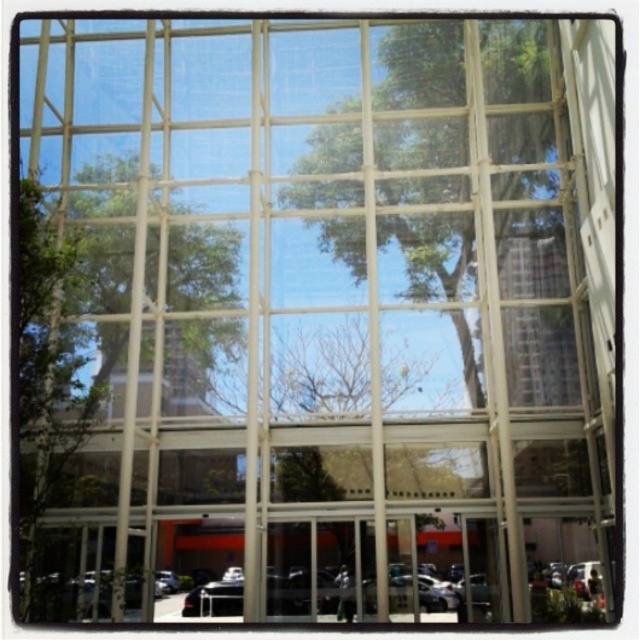
Can you confirm if green leafy tree at center is positioned to the right of green leafy tree at upper left?

Indeed, green leafy tree at center is positioned on the right side of green leafy tree at upper left.

Who is positioned more to the left, green leafy tree at center or green leafy tree at upper left?

green leafy tree at upper left

Does point (380, 122) lie behind point (230, 280)?

Yes.

The height and width of the screenshot is (640, 640). In order to click on green leafy tree at center in this screenshot , I will do `click(467, 160)`.